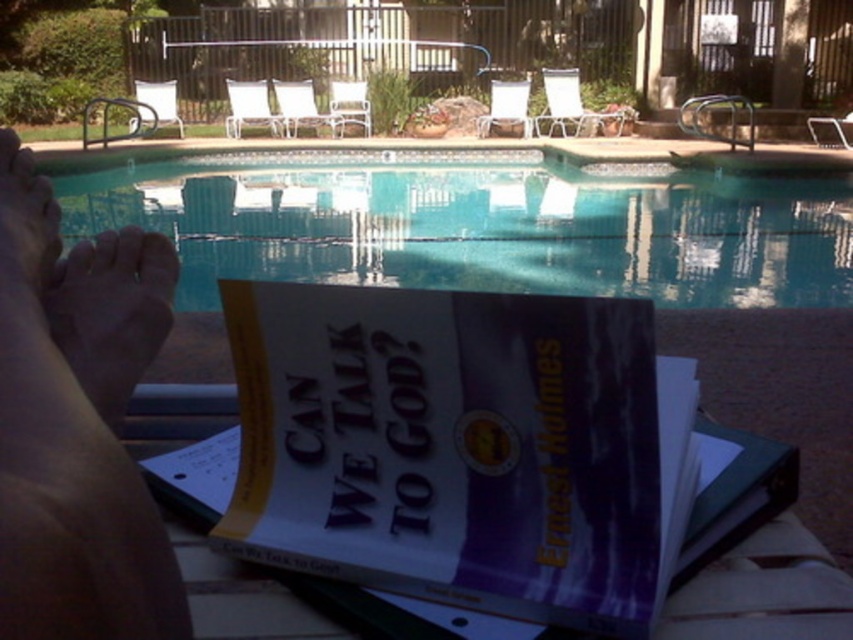
Question: Is purple paper book at center further to the viewer compared to brown skin at lower left?

Choices:
 (A) yes
 (B) no

Answer: (B)

Question: Does clear glass water at center appear on the left side of skinny bare feet at lower left?

Choices:
 (A) no
 (B) yes

Answer: (B)

Question: Considering the relative positions of purple paper book at center and skinny bare feet at lower left in the image provided, where is purple paper book at center located with respect to skinny bare feet at lower left?

Choices:
 (A) left
 (B) right

Answer: (B)

Question: Which of the following is the farthest from the observer?

Choices:
 (A) pale skin at lower left
 (B) clear glass water at center
 (C) purple paper book at center
 (D) skinny bare feet at lower left

Answer: (B)

Question: Which point appears farthest from the camera in this image?

Choices:
 (A) (125, 508)
 (B) (79, 372)
 (C) (386, 291)

Answer: (C)

Question: Based on their relative distances, which object is nearer to the clear glass water at center?

Choices:
 (A) purple paper book at center
 (B) pale skin at lower left

Answer: (B)